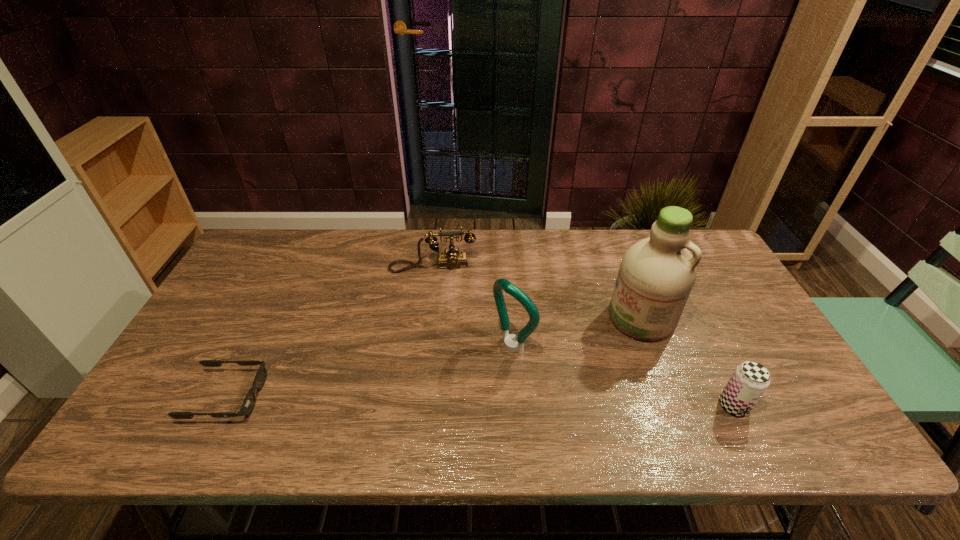
The height and width of the screenshot is (540, 960). I want to click on free location at the right edge of the desktop, so click(702, 291).

Find the location of a particular element. The width and height of the screenshot is (960, 540). vacant space at the far left corner of the desktop is located at coordinates (295, 238).

Where is `free space that is in between the telephone and the fourth shortest object`? free space that is in between the telephone and the fourth shortest object is located at coordinates (472, 306).

Identify the location of unoccupied position between the tallest object and the beer can. (x=687, y=362).

Locate an element on the screen. unoccupied position between the sunglasses and the third object from right to left is located at coordinates (370, 372).

Find the location of a particular element. The height and width of the screenshot is (540, 960). free spot between the tallest object and the rightmost object is located at coordinates (687, 362).

Image resolution: width=960 pixels, height=540 pixels. Identify the location of vacant point located between the rightmost object and the third object from left to right. (623, 376).

Identify the location of unoccupied position between the rightmost object and the leftmost object. (480, 401).

Find the location of a particular element. Image resolution: width=960 pixels, height=540 pixels. vacant area that lies between the fourth object from left to right and the rightmost object is located at coordinates (687, 362).

Find the location of `unoccupied position between the sunglasses and the second tallest object`. unoccupied position between the sunglasses and the second tallest object is located at coordinates (370, 372).